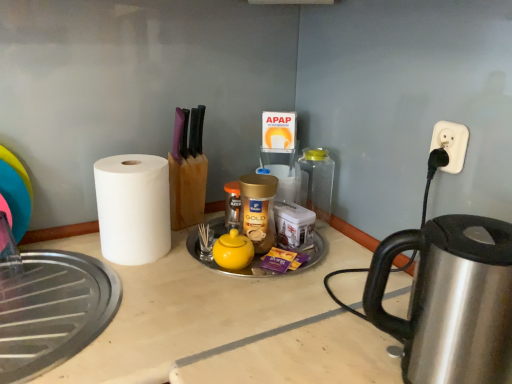
Identify the location of vacant region to the right of yellow matte tea pot at center. The width and height of the screenshot is (512, 384). (292, 263).